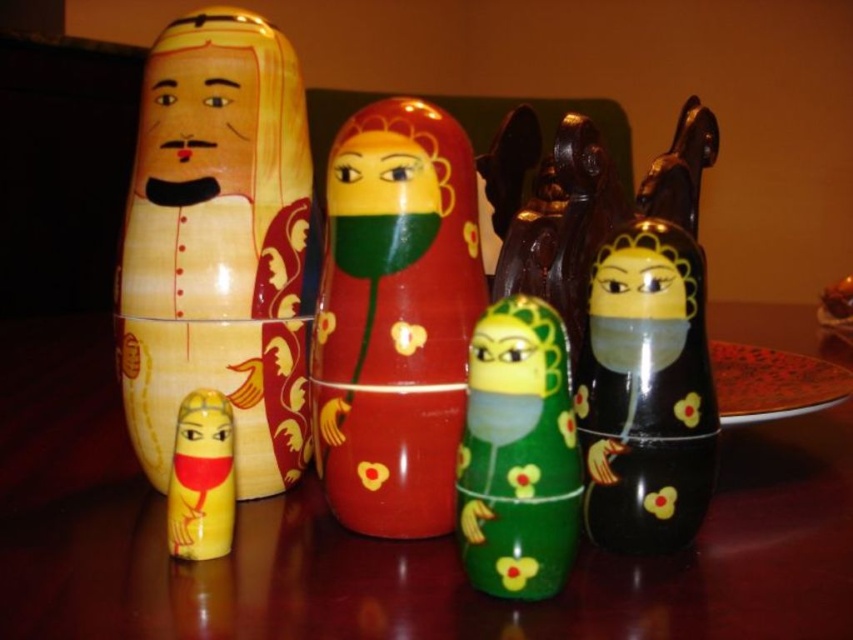
You are organizing a display of Russian nesting dolls and notice two items labeled as the matte yellow doll at lower left and the yellow matte face at center. According to the arrangement in the image, which one is positioned closer to the front?

The matte yellow doll at lower left is closer to the front since the yellow matte face at center is positioned behind it.

You are organizing the Russian nesting dolls on the dark wooden surface. The shiny red wood nesting doll at center is currently at position point. Where should you place it to ensure it aligns with the correct nesting order based on its size compared to the other dolls?

The shiny red wood nesting doll at center should be placed in the correct position within the nesting sequence. Since it is located at point, it should be positioned between the larger yellow doll on the left and the smaller red doll with green and yellow floral patterns to maintain the proper size order.

You are an art curator examining the arrangement of the Russian nesting dolls on the dark wooden surface. You notice a point at coordinates [201,477]. Which doll is located at this point?

The matte yellow doll at lower left is located at point [201,477].